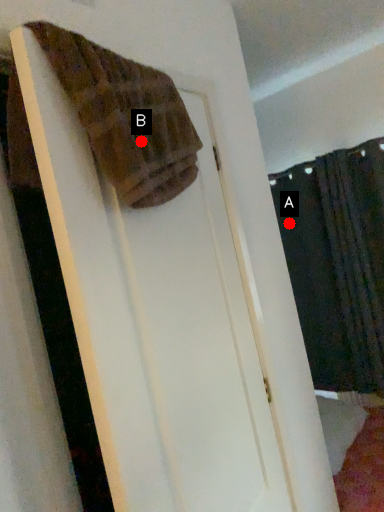
Question: Two points are circled on the image, labeled by A and B beside each circle. Among these points, which one is farthest from the camera?

Choices:
 (A) A is further
 (B) B is further

Answer: (A)